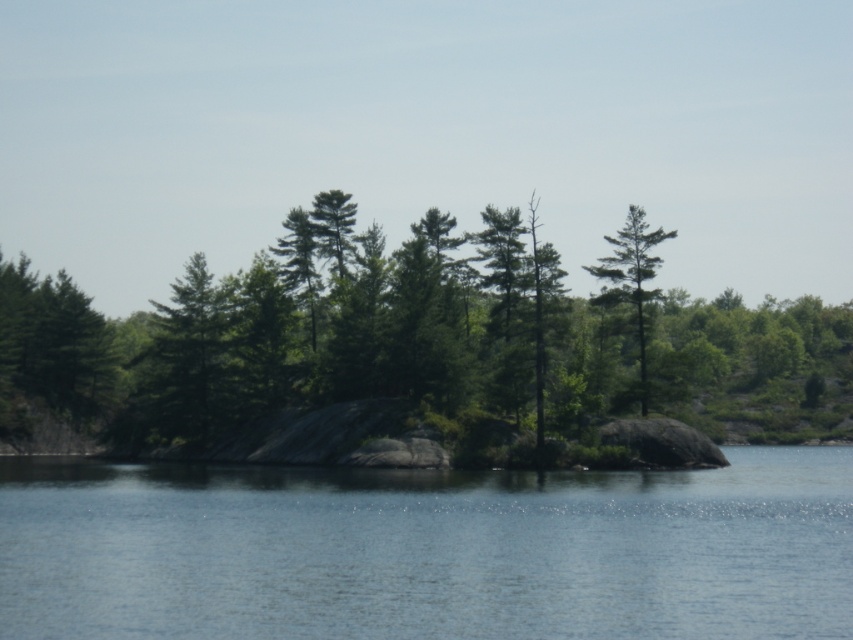
Can you confirm if green matte tree at center is taller than clear blue water at center?

Indeed, green matte tree at center has a greater height compared to clear blue water at center.

You are a GUI agent. You are given a task and a screenshot of the screen. Output one action in this format:
    pyautogui.click(x=<x>, y=<y>)
    Task: Click on the green matte tree at center
    The image size is (853, 640).
    Given the screenshot: What is the action you would take?
    pyautogui.click(x=415, y=348)

Where is `green matte tree at center`? The image size is (853, 640). green matte tree at center is located at coordinates (415, 348).

Does green matte tree at center lie in front of green matte tree at upper right?

Yes, green matte tree at center is closer to the viewer.

Can you confirm if green matte tree at center is bigger than green matte tree at upper right?

Yes, green matte tree at center is bigger than green matte tree at upper right.

Is point (15, 422) more distant than point (605, 301)?

Yes, point (15, 422) is behind point (605, 301).

This screenshot has height=640, width=853. Identify the location of green matte tree at center. (415, 348).

Is the position of clear blue water at center less distant than that of green matte tree at upper right?

Yes, it is.

Is clear blue water at center positioned at the back of green matte tree at upper right?

That is False.

Which is behind, point (590, 513) or point (648, 230)?

Positioned behind is point (648, 230).

The width and height of the screenshot is (853, 640). I want to click on clear blue water at center, so click(x=427, y=550).